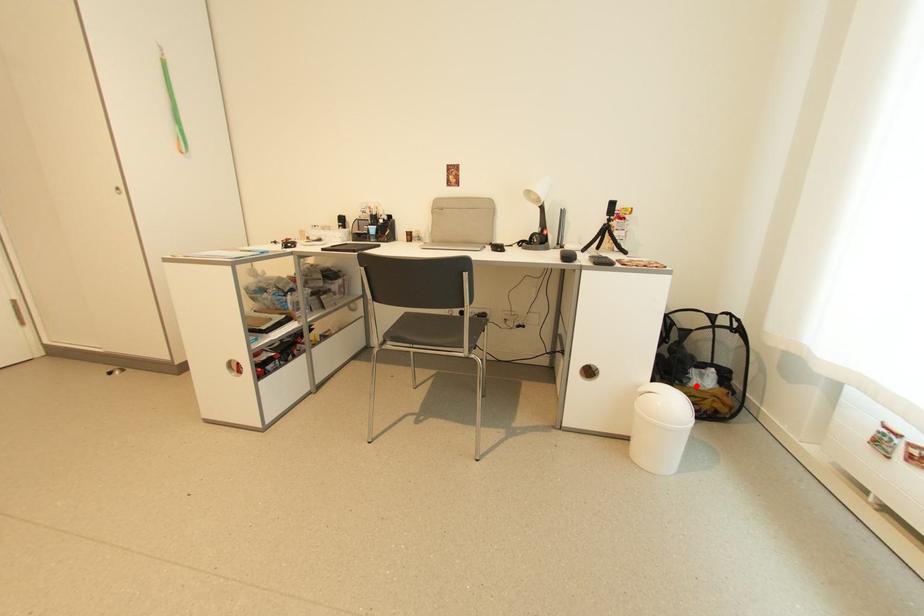
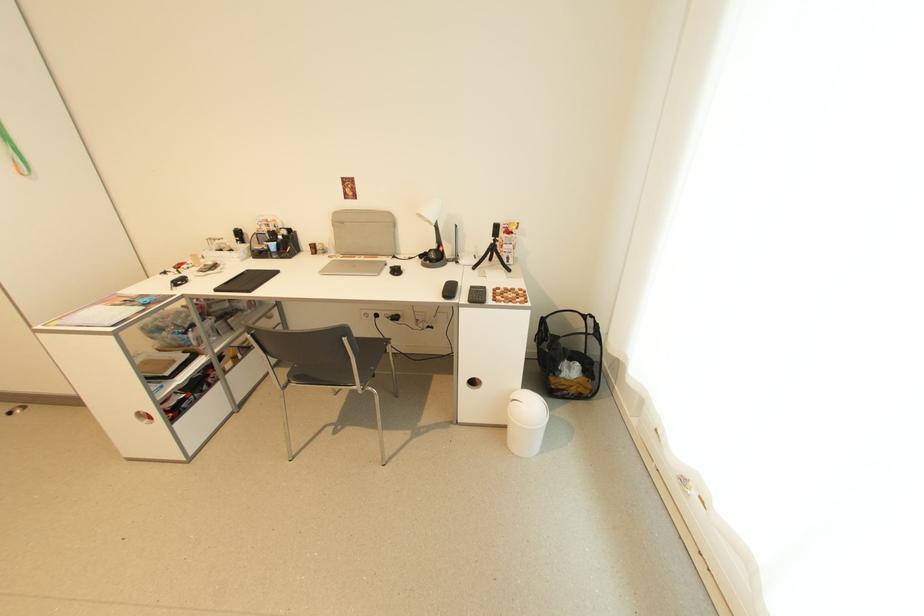
Question: I am providing you with two images of the same scene from different viewpoints. Given a red point in image1, look at the same physical point in image2. Is it:

Choices:
 (A) Closer to the viewpoint
 (B) Farther from the viewpoint

Answer: (B)